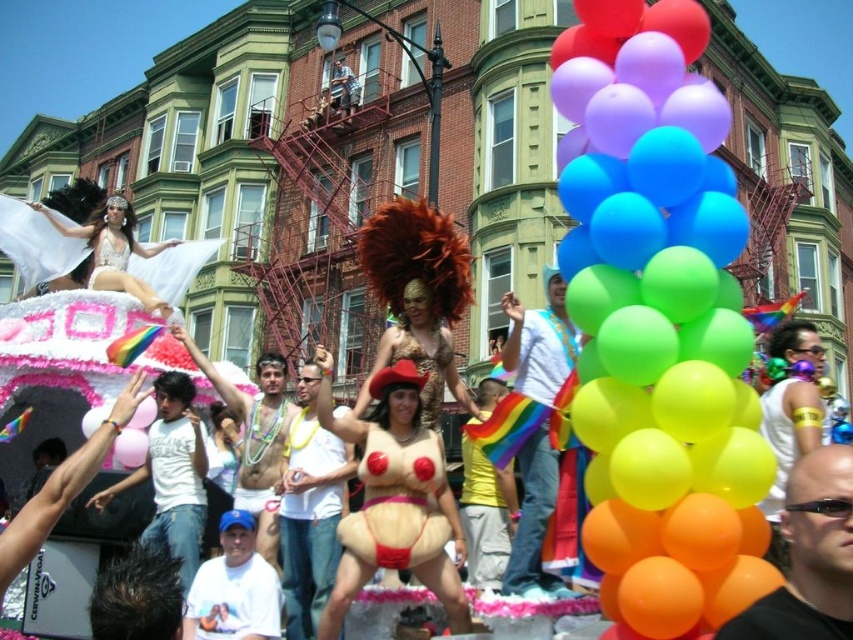
Question: Does matte red wig at center appear under shiny silver bikini at center?

Choices:
 (A) yes
 (B) no

Answer: (A)

Question: Can you confirm if matte red wig at center is wider than matte gold dress at center?

Choices:
 (A) yes
 (B) no

Answer: (A)

Question: Is rubber balloons at center thinner than shiny silver bikini at center?

Choices:
 (A) no
 (B) yes

Answer: (B)

Question: Which object appears closest to the camera in this image?

Choices:
 (A) matte gold dress at center
 (B) matte red wig at center

Answer: (B)

Question: Which of the following is the closest to the observer?

Choices:
 (A) (753, 456)
 (B) (113, 224)
 (C) (372, 481)
 (D) (422, 365)

Answer: (A)

Question: Which object is farther from the camera taking this photo?

Choices:
 (A) velvet pink lingerie at center
 (B) matte red wig at center

Answer: (A)